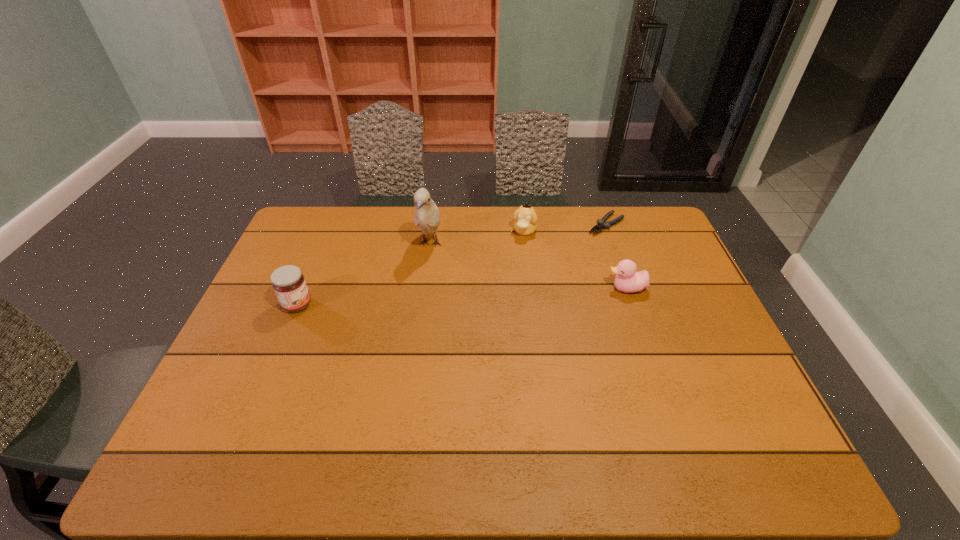
The height and width of the screenshot is (540, 960). I want to click on free space located on the front-facing side of the nearer duckling, so click(525, 288).

Find the location of a particular element. vacant space located on the front-facing side of the nearer duckling is located at coordinates (580, 288).

The width and height of the screenshot is (960, 540). Identify the location of free spot located on the face of the left duckling. (518, 249).

The width and height of the screenshot is (960, 540). In order to click on free space located on the face of the left duckling in this screenshot , I will do `click(496, 305)`.

Find the location of a particular element. This screenshot has height=540, width=960. vacant point located on the face of the left duckling is located at coordinates (489, 325).

The width and height of the screenshot is (960, 540). Identify the location of vacant space located at the beak of the tallest object. (423, 275).

Where is `vacant position located at the beak of the tallest object`? vacant position located at the beak of the tallest object is located at coordinates [x=417, y=301].

This screenshot has height=540, width=960. In order to click on vacant space positioned at the beak of the tallest object in this screenshot , I will do `click(417, 301)`.

I want to click on vacant point located 0.220m at the gripping part of the pliers, so click(555, 261).

The image size is (960, 540). Identify the location of vacant point located at the gripping part of the pliers. (522, 285).